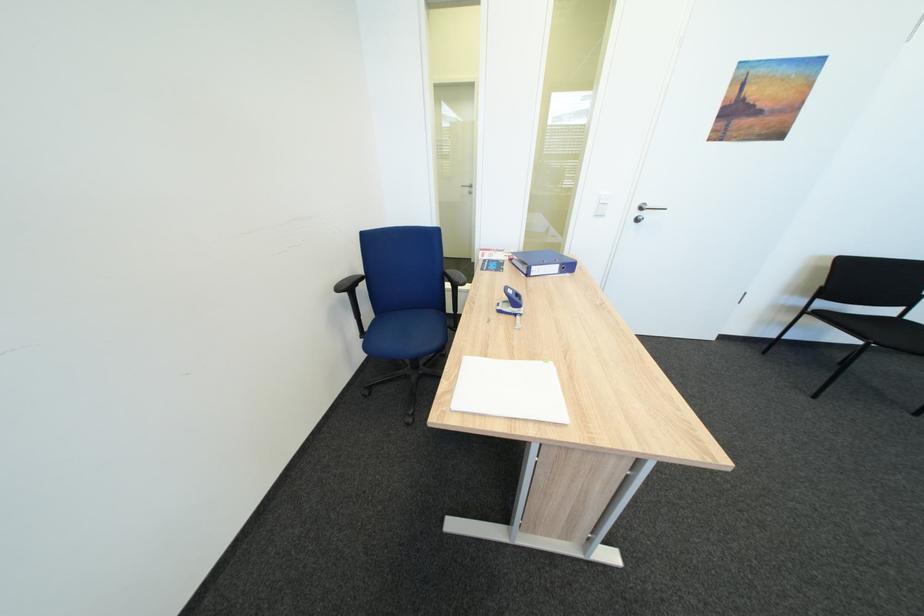
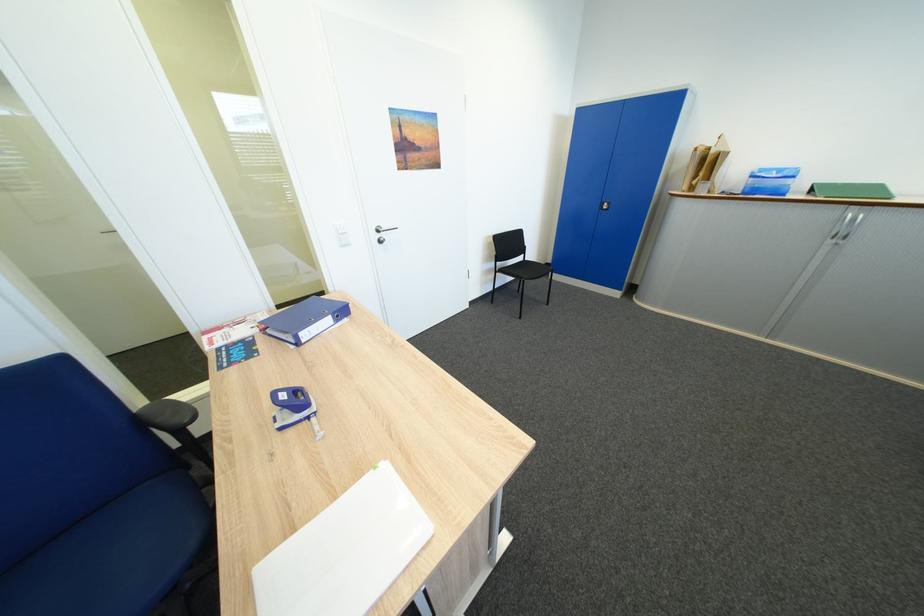
Where in the second image is the point corresponding to (523,317) from the first image?

(314, 424)